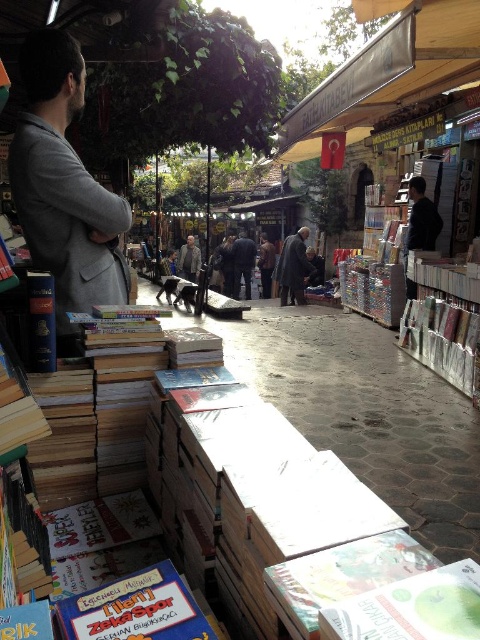
You are a customer at this book market and want to pick up the hardcover book at lower left and the dark gray coat at center. Which item should you reach for first to grab both without moving your position?

You should reach for the hardcover book at lower left first since it is closer to you than the dark gray coat at center, allowing you to pick up both items without moving your position.

You are a customer at the book market and want to buy a coat to stay warm. You see the gray wool coat at left and the dark gray jacket at right. Which one is taller?

The gray wool coat at left is taller than the dark gray jacket at right.

You are organizing a book sale and need to place the hardcover book at lower left and the dark gray coat at center on a small shelf. Which item should you place first to ensure both fit?

The hardcover book at lower left should be placed first because it occupies less space than the dark gray coat at center, allowing both items to fit on the small shelf.